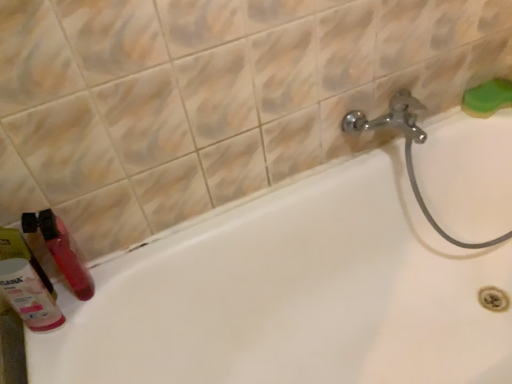
Question: Is matte pink bottle at lower left taller or shorter than matte plastic toothbrush at lower left?

Choices:
 (A) tall
 (B) short

Answer: (B)

Question: Do you think matte pink bottle at lower left is within matte plastic toothbrush at lower left, or outside of it?

Choices:
 (A) outside
 (B) inside

Answer: (A)

Question: Considering the real-world distances, which object is closest to the white glossy bathtub at lower left?

Choices:
 (A) matte pink bottle at lower left
 (B) matte plastic toothbrush at lower left
 (C) green sponge at upper right

Answer: (B)

Question: Which object is positioned farthest from the green sponge at upper right?

Choices:
 (A) matte plastic toothbrush at lower left
 (B) white glossy bathtub at lower left
 (C) matte pink bottle at lower left

Answer: (C)